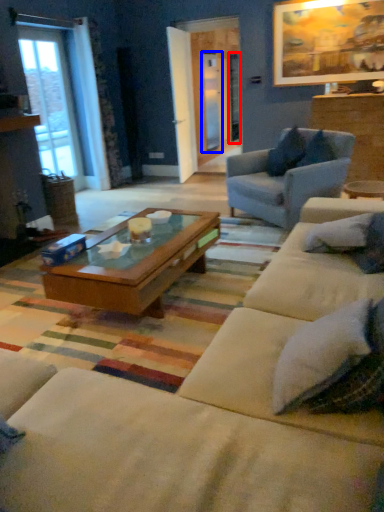
Question: Which object appears closest to the camera in this image, screen door (highlighted by a red box) or screen door (highlighted by a blue box)?

Choices:
 (A) screen door
 (B) screen door

Answer: (B)